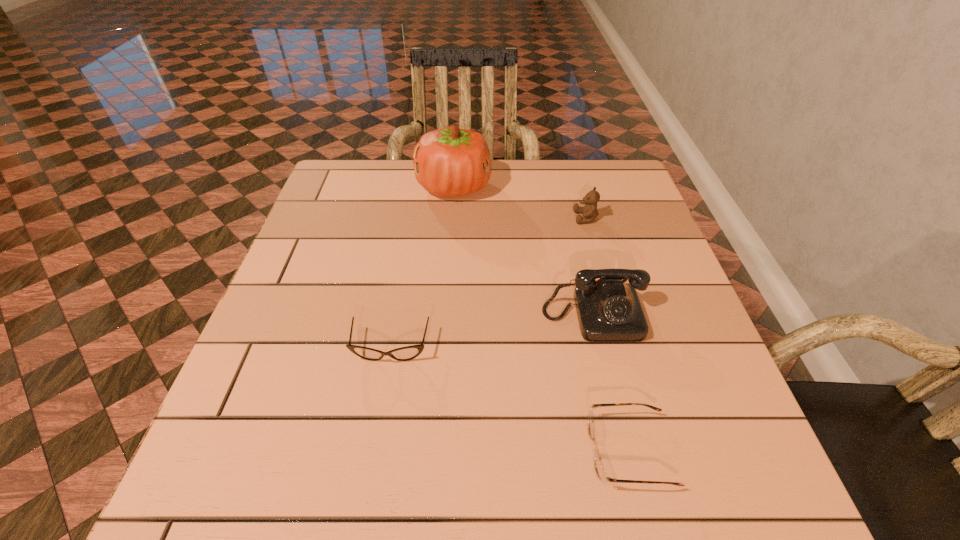
What are the coordinates of `empty space that is in between the telephone and the fourth tallest object` in the screenshot? It's located at (492, 332).

Locate an element on the screen. This screenshot has height=540, width=960. vacant region between the telephone and the left spectacles is located at coordinates (492, 332).

I want to click on free space between the second tallest object and the teddy bear, so click(589, 267).

This screenshot has width=960, height=540. What are the coordinates of `unoccupied area between the farther spectacles and the third shortest object` in the screenshot? It's located at (489, 282).

You are a GUI agent. You are given a task and a screenshot of the screen. Output one action in this format:
    pyautogui.click(x=<x>, y=<y>)
    Task: Click on the free point between the telephone and the teddy bear
    
    Given the screenshot: What is the action you would take?
    pyautogui.click(x=589, y=267)

Where is `vacant area that lies between the fourth shortest object and the right spectacles`? vacant area that lies between the fourth shortest object and the right spectacles is located at coordinates (612, 383).

At what (x,y) coordinates should I click in order to perform the action: click on free point between the second shortest object and the shorter spectacles. Please return your answer as a coordinate pair (x, y). The image size is (960, 540). Looking at the image, I should click on (511, 399).

Locate an element on the screen. free space between the left spectacles and the second farthest object is located at coordinates (489, 282).

Locate an element on the screen. The width and height of the screenshot is (960, 540). blank region between the tallest object and the taller spectacles is located at coordinates pyautogui.click(x=422, y=267).

Where is `object that is the fourth closest to the right spectacles`? The width and height of the screenshot is (960, 540). object that is the fourth closest to the right spectacles is located at coordinates (448, 162).